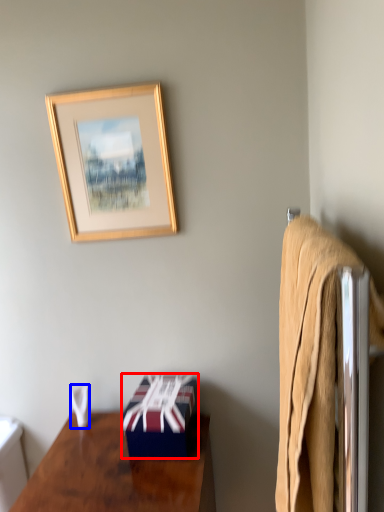
Question: Among these objects, which one is farthest to the camera, box (highlighted by a red box) or towel/napkin (highlighted by a blue box)?

Choices:
 (A) box
 (B) towel/napkin

Answer: (B)